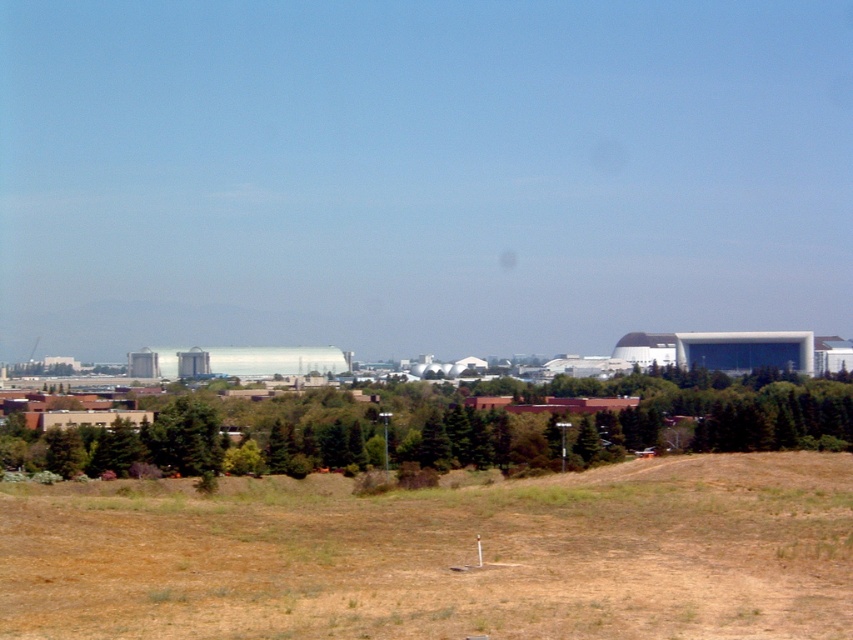
From the picture: You are standing at the point marked by coordinates point (440, 554) in the image. What is the terrain like at this location?

The terrain at point (440, 554) is brown grass at lower center, which is dry and patchy with signs of wear or lack of moisture as described in the scene.

Looking at this image, you are a landscape architect designing a new garden. You have a limited budget and need to choose between planting more brown grass at lower center or expanding the green leafy tree at lower center. Given their sizes, which option would allow for more coverage without exceeding the available space?

The green leafy tree at lower center has a greater width than the brown grass at lower center, so expanding the green leafy tree at lower center would provide more coverage without exceeding the available space.